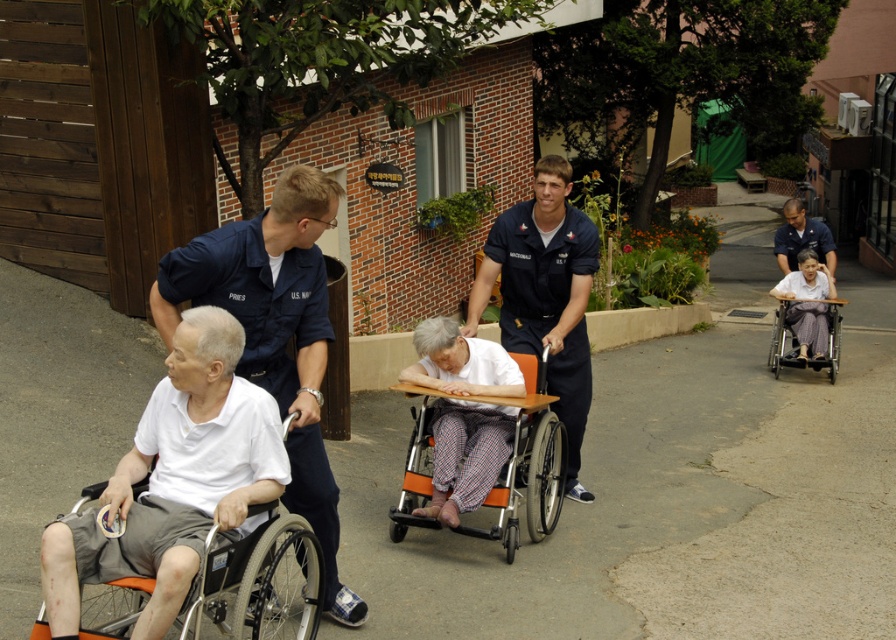
Question: Is blue uniform at center to the right of orange plastic wheelchair at center from the viewer's perspective?

Choices:
 (A) no
 (B) yes

Answer: (B)

Question: Does matte blue uniform at center have a greater width compared to orange fabric wheelchair at left?

Choices:
 (A) yes
 (B) no

Answer: (B)

Question: Which of the following is the closest to the observer?

Choices:
 (A) (274, 225)
 (B) (803, 355)
 (C) (800, 307)

Answer: (A)

Question: Which object is farther from the camera taking this photo?

Choices:
 (A) orange plastic wheelchair at right
 (B) blue uniform shirt at upper right
 (C) patterned fabric wheelchair at right
 (D) orange plastic wheelchair at center

Answer: (C)

Question: Can you confirm if matte blue uniform at center is positioned above orange plastic wheelchair at right?

Choices:
 (A) yes
 (B) no

Answer: (B)

Question: Which object is closer to the camera taking this photo?

Choices:
 (A) matte blue uniform at center
 (B) blue uniform shirt at upper right
 (C) orange fabric wheelchair at left
 (D) orange plastic wheelchair at right

Answer: (C)